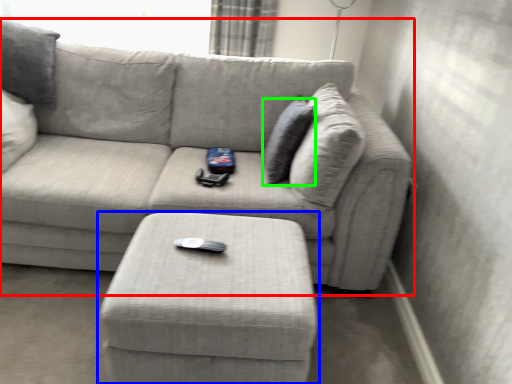
Question: Which object is positioned farthest from studio couch (highlighted by a red box)? Select from table (highlighted by a blue box) and pillow (highlighted by a green box).

Choices:
 (A) table
 (B) pillow

Answer: (A)